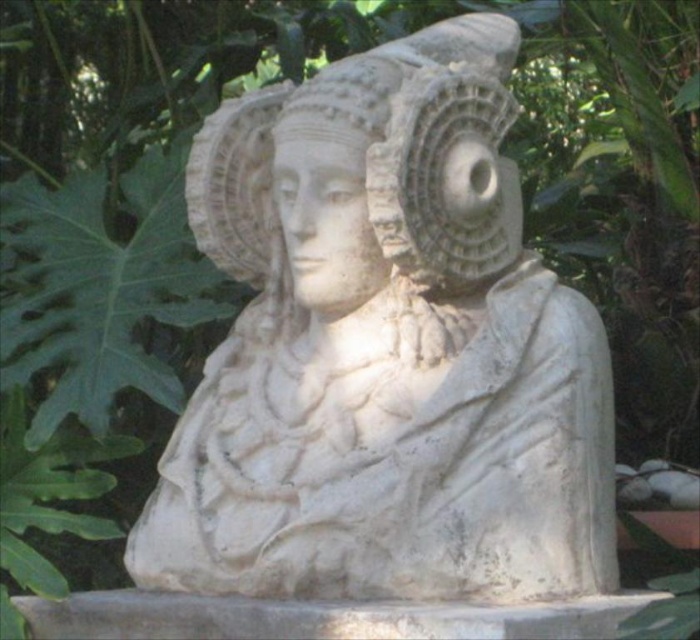
Can you confirm if white marble bust at center is positioned to the left of white stone bust at center?

Incorrect, white marble bust at center is not on the left side of white stone bust at center.

The image size is (700, 640). Describe the element at coordinates (385, 352) in the screenshot. I see `white marble bust at center` at that location.

Identify the location of white marble bust at center. The height and width of the screenshot is (640, 700). [x=385, y=352].